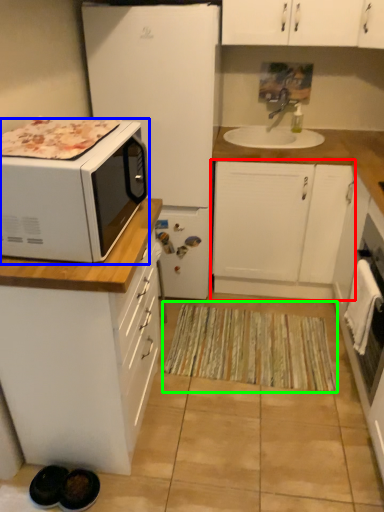
Question: Estimate the real-world distances between objects in this image. Which object is farther from cabinetry (highlighted by a red box), microwave oven (highlighted by a blue box) or doormat (highlighted by a green box)?

Choices:
 (A) microwave oven
 (B) doormat

Answer: (A)